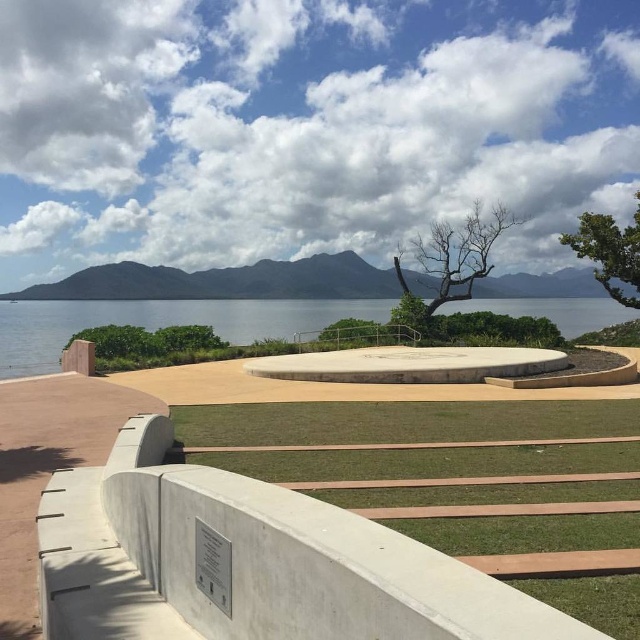
Does green grass at lower center have a greater width compared to green leafy tree at upper right?

Yes, green grass at lower center is wider than green leafy tree at upper right.

Is green grass at lower center taller than green leafy tree at upper right?

No, green grass at lower center is not taller than green leafy tree at upper right.

Does point (433, 461) come closer to viewer compared to point (634, 268)?

That is True.

You are a GUI agent. You are given a task and a screenshot of the screen. Output one action in this format:
    pyautogui.click(x=<x>, y=<y>)
    Task: Click on the green grass at lower center
    The height and width of the screenshot is (640, 640).
    Given the screenshot: What is the action you would take?
    pyautogui.click(x=410, y=438)

Is green grass at lower center positioned in front of clear water at center?

Yes, it is in front of clear water at center.

Who is more distant from viewer, (280, 438) or (605, 308)?

The point (605, 308) is more distant.

Describe the element at coordinates (410, 438) in the screenshot. The width and height of the screenshot is (640, 640). I see `green grass at lower center` at that location.

The width and height of the screenshot is (640, 640). What are the coordinates of `green grass at lower center` in the screenshot? It's located at (410, 438).

Is the position of clear water at center less distant than that of bare wood tree at center?

Yes, it is.

Is clear water at center smaller than bare wood tree at center?

No.

Is point (60, 300) positioned before point (508, 212)?

No, it is not.

Identify the location of clear water at center. Image resolution: width=640 pixels, height=640 pixels. (161, 323).